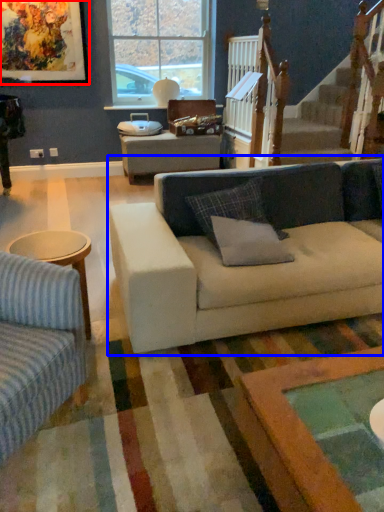
Question: Which of the following is the closest to the observer, picture frame (highlighted by a red box) or studio couch (highlighted by a blue box)?

Choices:
 (A) picture frame
 (B) studio couch

Answer: (B)